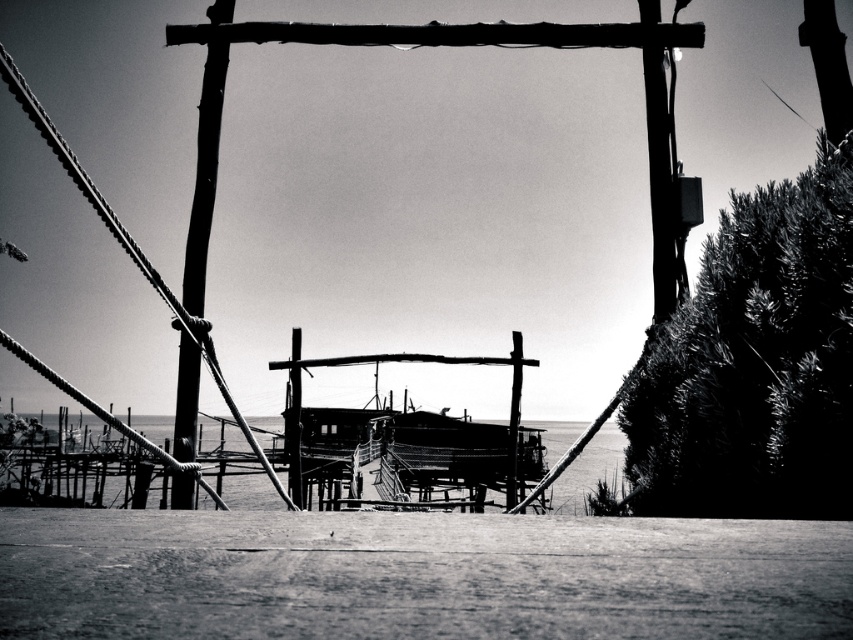
You are standing at the wooden structure in the foreground and want to determine the relative positions of two points marked in the image. Which point is closer to you, point 1 at coordinates (178, 394) or point 2 at coordinates (294, 420)?

Point 1 at coordinates (178, 394) is closer to you because it is in front of point 2 at coordinates (294, 420).

You are standing at the edge of the wooden structure in the image. You notice the wooden telegraph pole at center and the wooden boat at center. Which object is closer to you?

The wooden telegraph pole at center is closer to you because it is in front of the wooden boat at center.